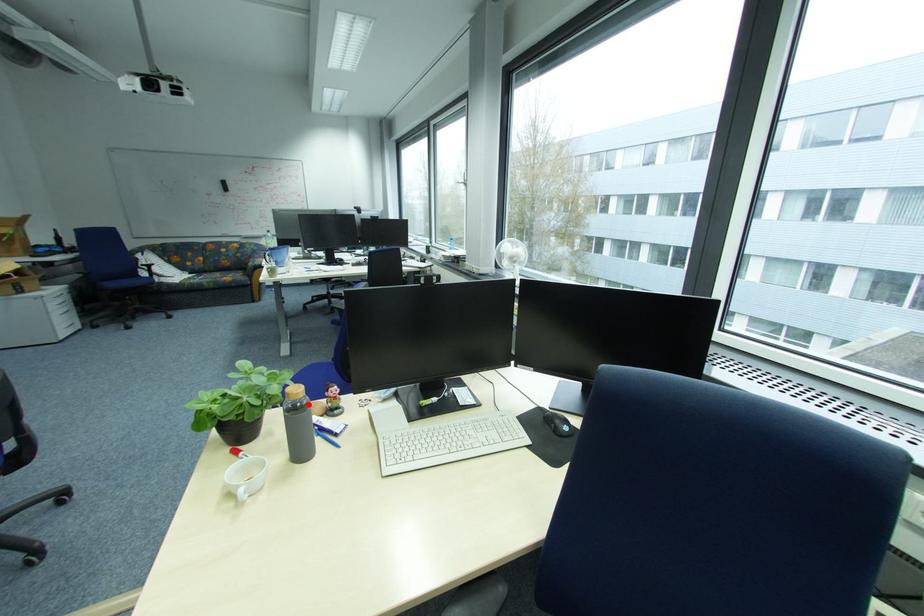
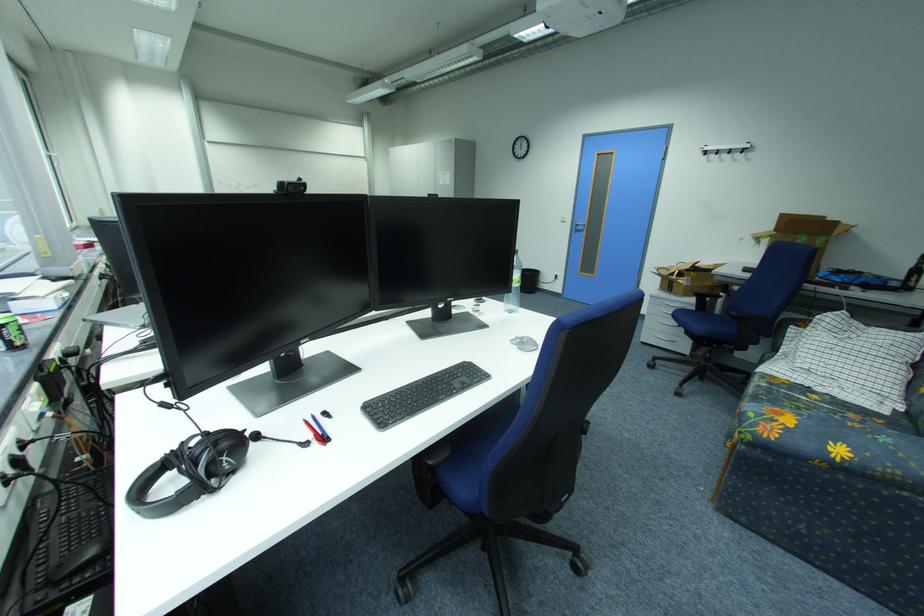
Question: I am providing you with two images of the same scene from different viewpoints. A red point is marked on the first image. Can you still see the location of the red point in image 2?

Choices:
 (A) Yes
 (B) No

Answer: (B)